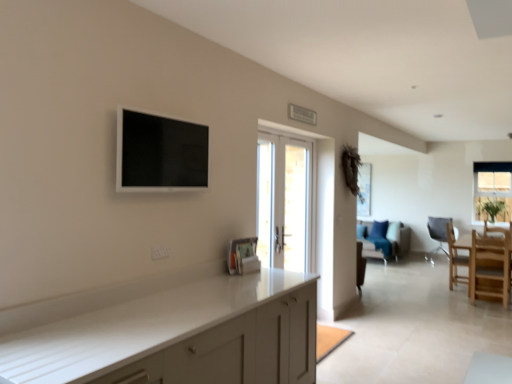
Question: Considering the relative positions of wooden chair at right, placed as the 2th chair when sorted from front to back, and matte gray chair at right, marked as the third chair in a front-to-back arrangement, in the image provided, is wooden chair at right, placed as the 2th chair when sorted from front to back, to the left of matte gray chair at right, marked as the third chair in a front-to-back arrangement, from the viewer's perspective?

Choices:
 (A) yes
 (B) no

Answer: (A)

Question: Can you confirm if wooden chair at right, the 2th chair from the back, is positioned to the right of matte gray chair at right, marked as the third chair in a front-to-back arrangement?

Choices:
 (A) yes
 (B) no

Answer: (B)

Question: From a real-world perspective, is wooden chair at right, placed as the 2th chair when sorted from front to back, located beneath matte gray chair at right, which is the 1th chair from back to front?

Choices:
 (A) no
 (B) yes

Answer: (A)

Question: Is matte gray chair at right, which is the 1th chair from back to front, located within wooden chair at right, placed as the 2th chair when sorted from front to back?

Choices:
 (A) no
 (B) yes

Answer: (A)

Question: From the image's perspective, is wooden chair at right, placed as the 2th chair when sorted from front to back, over matte gray chair at right, which is the 1th chair from back to front?

Choices:
 (A) no
 (B) yes

Answer: (A)

Question: Looking at their shapes, would you say clear glass window at upper right is wider or thinner than white glossy door at center?

Choices:
 (A) thin
 (B) wide

Answer: (A)

Question: From the image's perspective, relative to white glossy door at center, is clear glass window at upper right above or below?

Choices:
 (A) below
 (B) above

Answer: (B)

Question: From a real-world perspective, is clear glass window at upper right above or below white glossy door at center?

Choices:
 (A) below
 (B) above

Answer: (B)

Question: In terms of size, does clear glass window at upper right appear bigger or smaller than white glossy door at center?

Choices:
 (A) small
 (B) big

Answer: (A)

Question: Is light wood chair at lower right, acting as the 3th chair starting from the back, situated inside white glossy door at center or outside?

Choices:
 (A) outside
 (B) inside

Answer: (A)

Question: Is light wood chair at lower right, acting as the 3th chair starting from the back, taller or shorter than white glossy door at center?

Choices:
 (A) tall
 (B) short

Answer: (B)

Question: In terms of width, does light wood chair at lower right, the 1th chair from the front, look wider or thinner when compared to white glossy door at center?

Choices:
 (A) wide
 (B) thin

Answer: (A)

Question: Considering the relative positions of light wood chair at lower right, the 1th chair from the front, and white glossy door at center in the image provided, is light wood chair at lower right, the 1th chair from the front, to the left or to the right of white glossy door at center?

Choices:
 (A) right
 (B) left

Answer: (A)

Question: Is velvet blue couch at center wider or thinner than matte gray chair at right, which is the 1th chair from back to front?

Choices:
 (A) thin
 (B) wide

Answer: (B)

Question: Considering the positions of point (371, 256) and point (426, 221), is point (371, 256) closer or farther from the camera than point (426, 221)?

Choices:
 (A) closer
 (B) farther

Answer: (A)